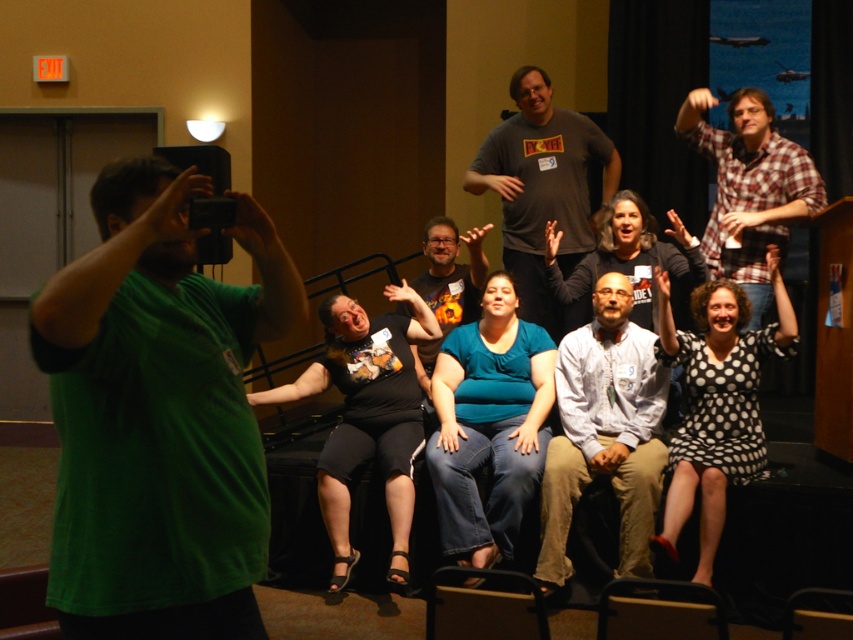
Which of these two, green matte shirt at left or black dotted dress at center, stands shorter?

With less height is green matte shirt at left.

Looking at this image, measure the distance between green matte shirt at left and camera.

A distance of 5.24 feet exists between green matte shirt at left and camera.

Between point (190, 397) and point (670, 556), which one is positioned behind?

Point (670, 556)

This screenshot has height=640, width=853. I want to click on green matte shirt at left, so click(x=158, y=416).

Does green matte shirt at left have a greater width compared to matte black shirt at center?

No, green matte shirt at left is not wider than matte black shirt at center.

Can you confirm if green matte shirt at left is bigger than matte black shirt at center?

No, green matte shirt at left is not bigger than matte black shirt at center.

Is point (144, 444) positioned behind point (467, 289)?

No, it is not.

Identify the location of green matte shirt at left. (158, 416).

Between green matte shirt at left and white shirt at center, which one has less height?

With less height is green matte shirt at left.

Does green matte shirt at left appear on the left side of white shirt at center?

Indeed, green matte shirt at left is positioned on the left side of white shirt at center.

Which is in front, point (210, 563) or point (566, 452)?

Point (210, 563) is more forward.

At what (x,y) coordinates should I click in order to perform the action: click on green matte shirt at left. Please return your answer as a coordinate pair (x, y). This screenshot has width=853, height=640. Looking at the image, I should click on (158, 416).